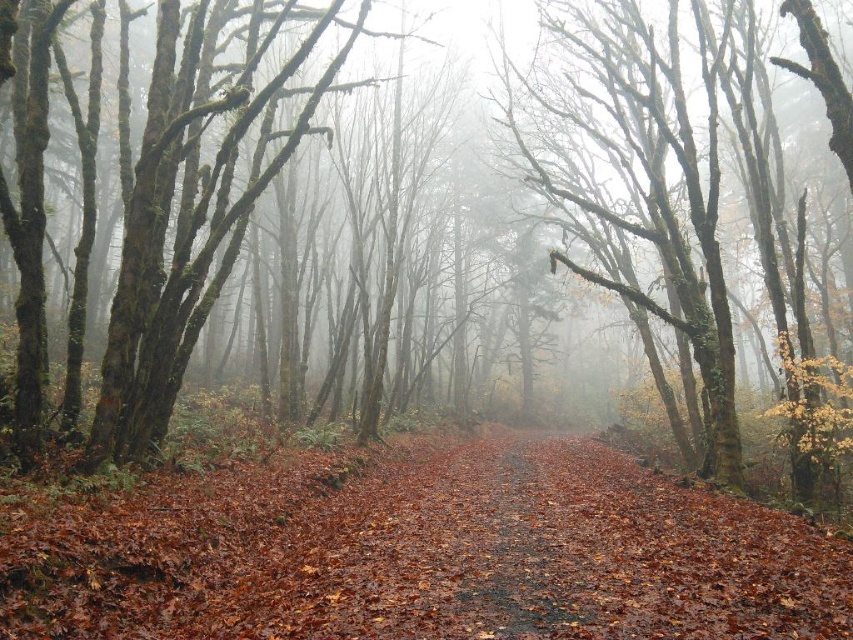
Question: Can you confirm if smooth bark tree at center is positioned above brown leafy forest path at center?

Choices:
 (A) no
 (B) yes

Answer: (B)

Question: Which of the following is the farthest from the observer?

Choices:
 (A) (705, 259)
 (B) (479, 595)

Answer: (A)

Question: Does smooth bark tree at center have a larger size compared to brown leafy forest path at center?

Choices:
 (A) no
 (B) yes

Answer: (B)

Question: Does smooth bark tree at center appear on the right side of brown leafy forest path at center?

Choices:
 (A) yes
 (B) no

Answer: (A)